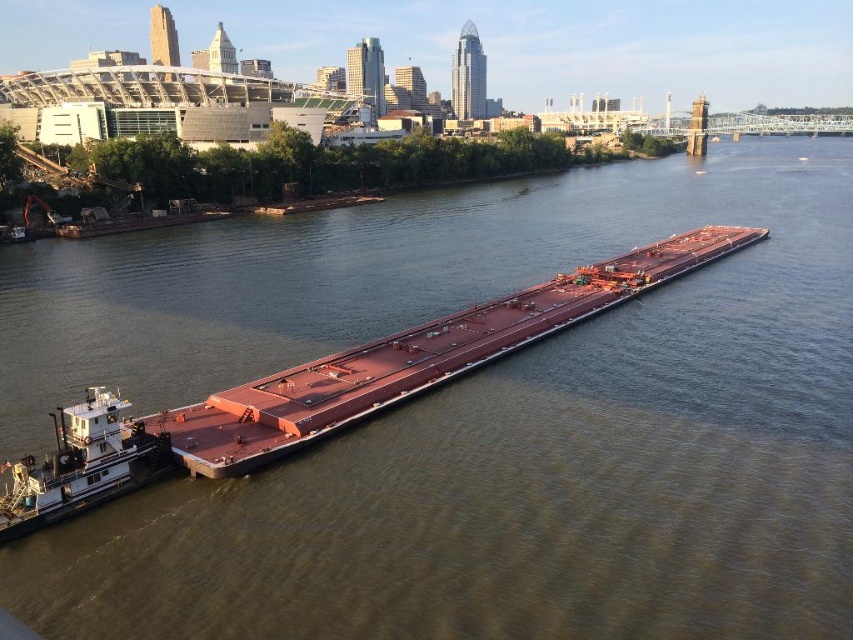
Looking at this image, is the position of smooth reddish-brown barge at center more distant than that of white painted steel tugboat at lower left?

Yes, it is.

Based on the photo, is smooth reddish-brown barge at center closer to camera compared to white painted steel tugboat at lower left?

No.

Between point (281, 428) and point (106, 490), which one is positioned in front?

Point (106, 490) is more forward.

What are the coordinates of `smooth reddish-brown barge at center` in the screenshot? It's located at (416, 356).